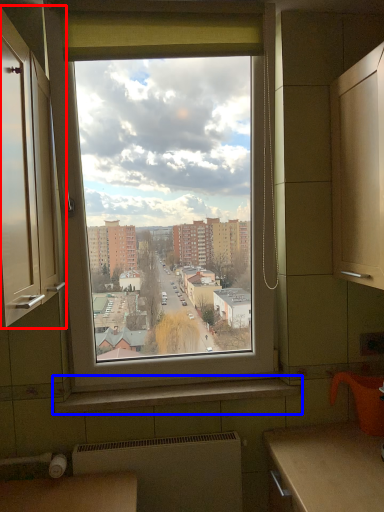
Question: Which object appears closest to the camera in this image, cabinetry (highlighted by a red box) or window sill (highlighted by a blue box)?

Choices:
 (A) cabinetry
 (B) window sill

Answer: (A)